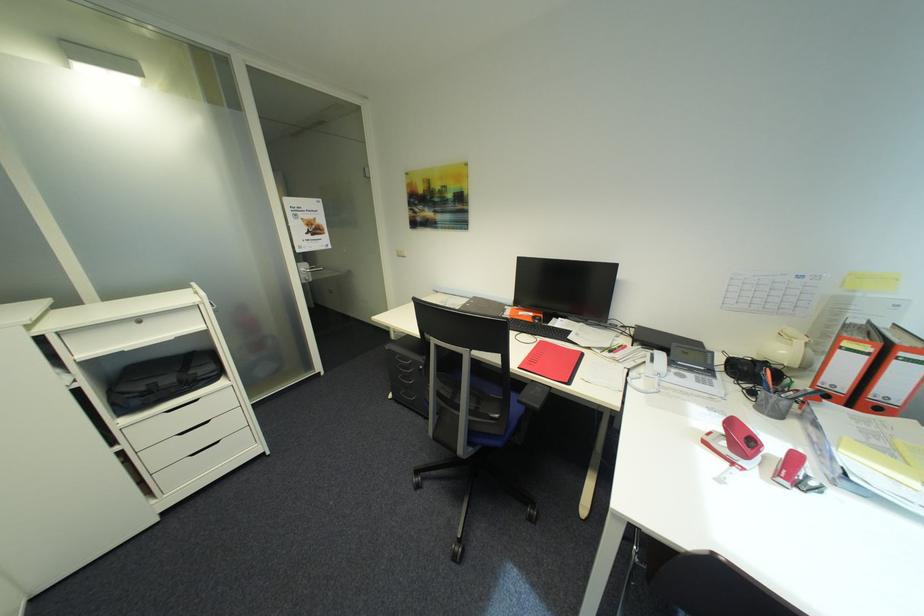
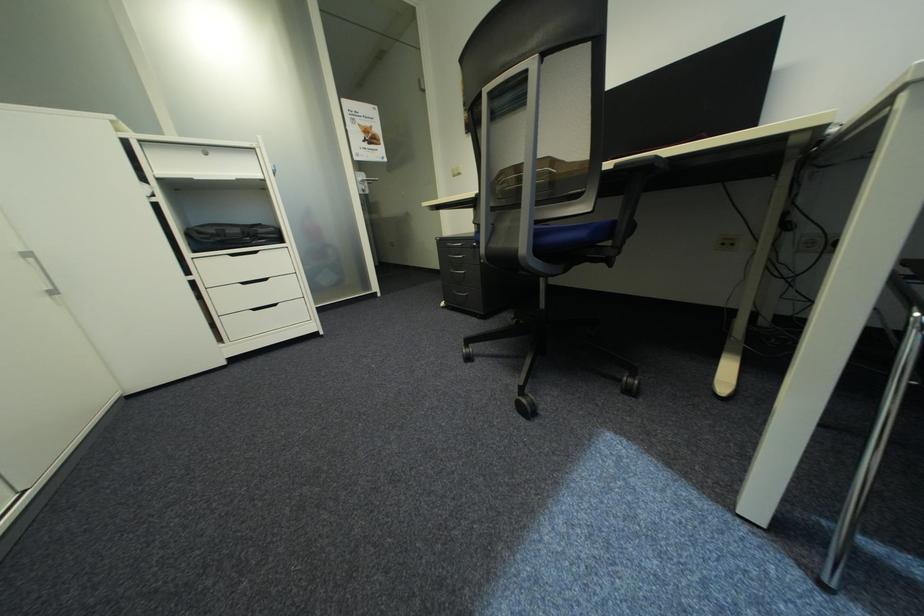
In the second image, find the point that corresponds to pixel 155 386 in the first image.

(225, 230)